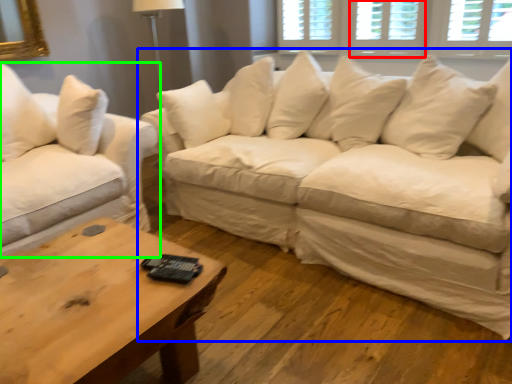
Question: Which object is positioned closest to window (highlighted by a red box)? Select from studio couch (highlighted by a blue box) and studio couch (highlighted by a green box).

Choices:
 (A) studio couch
 (B) studio couch

Answer: (A)